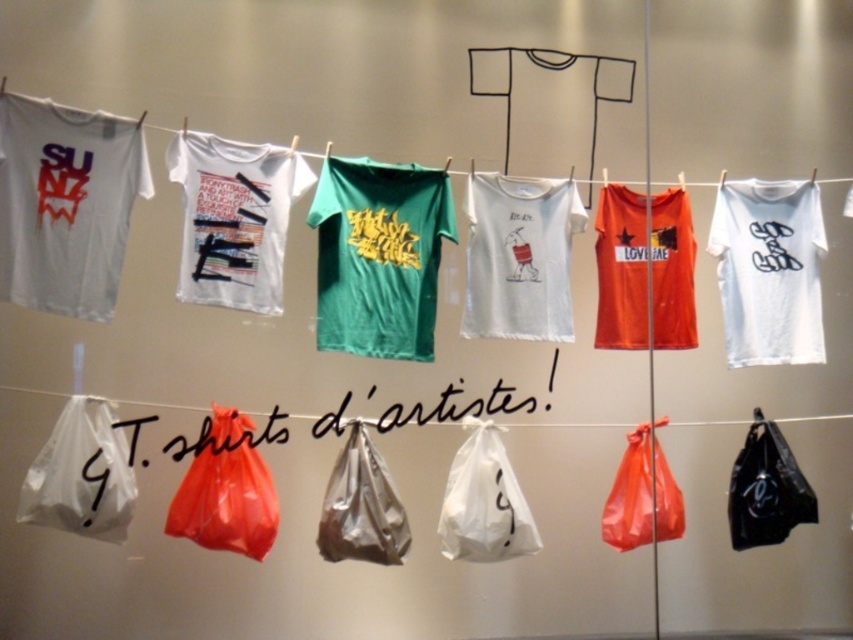
You are organizing the display and need to choose between the white plastic bag at lower left and the shiny plastic bag at lower center to hold a heavy item. Which bag should you choose based on their thickness?

The shiny plastic bag at lower center is thicker than the white plastic bag at lower left, so it is more suitable for holding heavy items.

You are standing in front of the Tshirt display. There is a white plastic bag at center marked by point (485,500). Can you tell me what is the nearest Tshirt to the white plastic bag at center?

The nearest Tshirt to the white plastic bag at center is the orange Tshirt with black star and the word LO. because it is closest to the marked point.